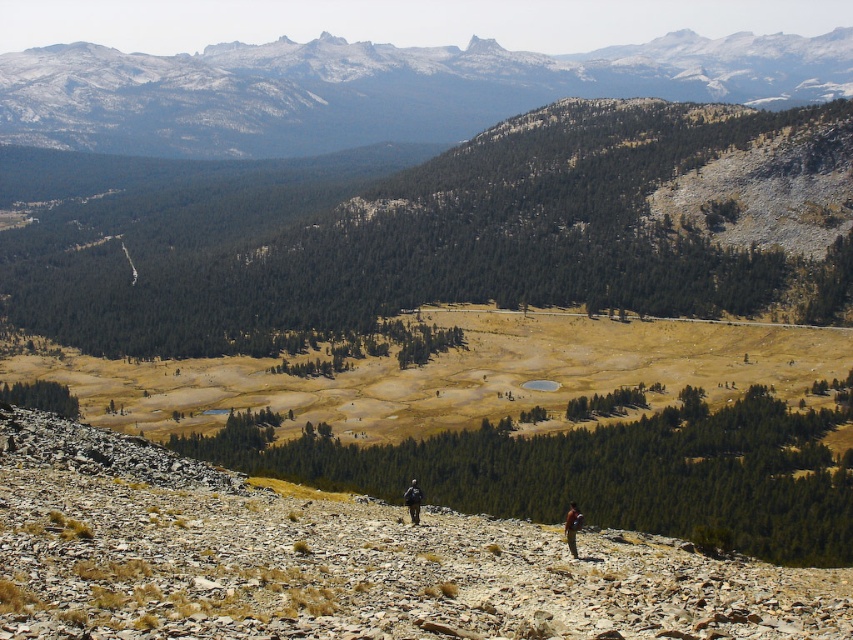
Can you confirm if snowy granite mountain at upper center is taller than brown leather jacket at lower center?

Indeed, snowy granite mountain at upper center has a greater height compared to brown leather jacket at lower center.

Who is positioned more to the left, snowy granite mountain at upper center or brown leather jacket at lower center?

Positioned to the left is brown leather jacket at lower center.

The height and width of the screenshot is (640, 853). What do you see at coordinates (376, 90) in the screenshot? I see `snowy granite mountain at upper center` at bounding box center [376, 90].

You are a GUI agent. You are given a task and a screenshot of the screen. Output one action in this format:
    pyautogui.click(x=<x>, y=<y>)
    Task: Click on the snowy granite mountain at upper center
    The image size is (853, 640).
    Given the screenshot: What is the action you would take?
    (x=376, y=90)

Is brown leather jacket at lower center taller than black fabric backpack at center?

Yes.

Does brown leather jacket at lower center have a larger size compared to black fabric backpack at center?

Yes, brown leather jacket at lower center is bigger than black fabric backpack at center.

Which is in front, point (570, 529) or point (403, 496)?

Point (570, 529)

Where is `brown leather jacket at lower center`? brown leather jacket at lower center is located at coordinates tap(572, 528).

Does snowy granite mountain at upper center have a smaller size compared to black fabric backpack at center?

No.

Who is taller, snowy granite mountain at upper center or black fabric backpack at center?

With more height is snowy granite mountain at upper center.

At what (x,y) coordinates should I click in order to perform the action: click on snowy granite mountain at upper center. Please return your answer as a coordinate pair (x, y). Looking at the image, I should click on click(x=376, y=90).